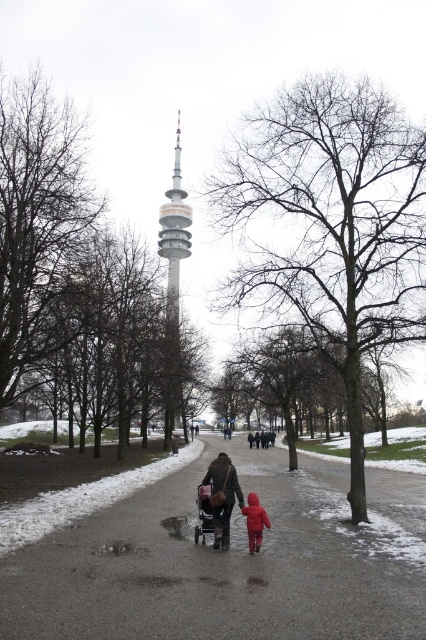
Consider the image. Who is positioned more to the left, smooth asphalt path at center or red matte jacket at center?

red matte jacket at center is more to the left.

Does smooth asphalt path at center lie behind red matte jacket at center?

No, it is in front of red matte jacket at center.

I want to click on smooth asphalt path at center, so click(x=230, y=563).

Which of these two, black plastic baby carriage at center or dark brown leather jacket at center, stands taller?

dark brown leather jacket at center

Measure the distance between point (x=213, y=528) and camera.

Point (x=213, y=528) and camera are 35.79 feet apart from each other.

The height and width of the screenshot is (640, 426). Identify the location of black plastic baby carriage at center. (206, 509).

Which is behind, point (232, 474) or point (204, 486)?

The point (204, 486) is behind.

Based on the photo, is brown leather jacket at center thinner than black plastic baby carriage at center?

No, brown leather jacket at center is not thinner than black plastic baby carriage at center.

Measure the distance between brown leather jacket at center and camera.

brown leather jacket at center and camera are 10.64 meters apart.

Locate an element on the screen. The width and height of the screenshot is (426, 640). brown leather jacket at center is located at coordinates (221, 497).